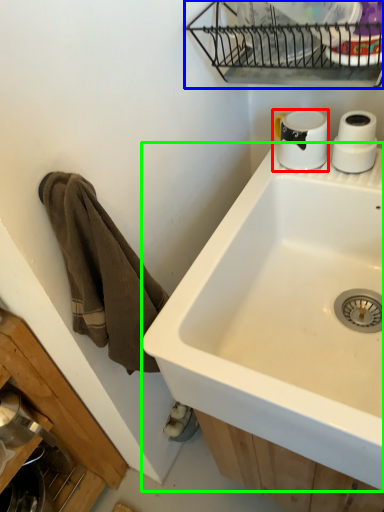
Question: Considering the real-world distances, which object is closest to coffee cup (highlighted by a red box)? appliance (highlighted by a blue box) or sink (highlighted by a green box).

Choices:
 (A) appliance
 (B) sink

Answer: (A)